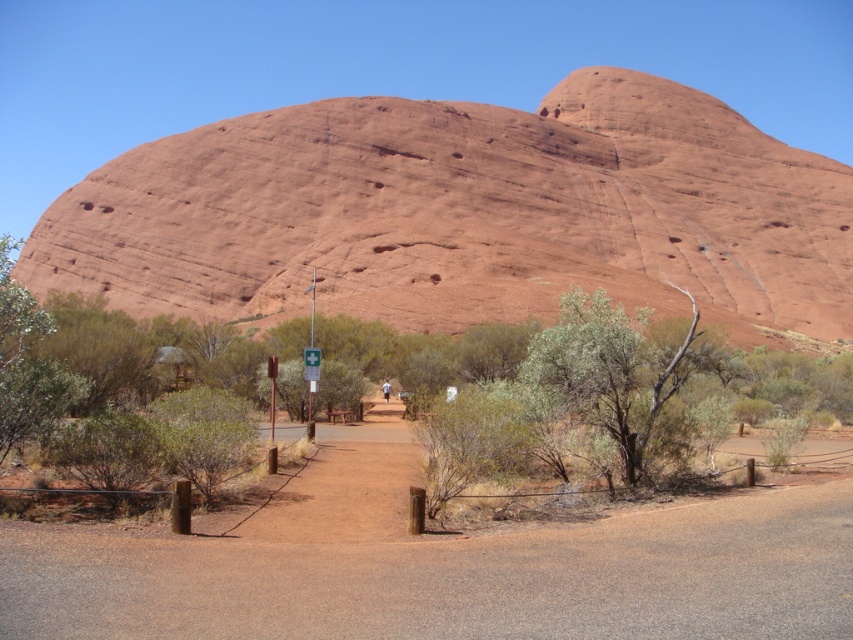
Is point (755, 289) positioned after point (317, 372)?

Yes, point (755, 289) is behind point (317, 372).

Does reddish-brown rock formation at upper center appear on the left side of green plastic sign at center?

In fact, reddish-brown rock formation at upper center is to the right of green plastic sign at center.

What do you see at coordinates (463, 212) in the screenshot? Image resolution: width=853 pixels, height=640 pixels. I see `reddish-brown rock formation at upper center` at bounding box center [463, 212].

You are a GUI agent. You are given a task and a screenshot of the screen. Output one action in this format:
    pyautogui.click(x=<x>, y=<y>)
    Task: Click on the reddish-brown rock formation at upper center
    This screenshot has height=640, width=853.
    Given the screenshot: What is the action you would take?
    pyautogui.click(x=463, y=212)

Which is below, green leafy shrub at lower center or green plastic sign at center?

green plastic sign at center is lower down.

What do you see at coordinates (614, 368) in the screenshot?
I see `green leafy shrub at lower center` at bounding box center [614, 368].

Find the location of a particular element. Image resolution: width=853 pixels, height=640 pixels. green leafy shrub at lower center is located at coordinates (614, 368).

Which of these two, green leafy bush at center or green plastic sign at center, stands shorter?

green plastic sign at center

Who is positioned more to the right, green leafy bush at center or green plastic sign at center?

Positioned to the right is green plastic sign at center.

Which is in front, point (238, 352) or point (312, 353)?

Point (312, 353) is more forward.

Locate an element on the screen. The height and width of the screenshot is (640, 853). green leafy bush at center is located at coordinates (526, 387).